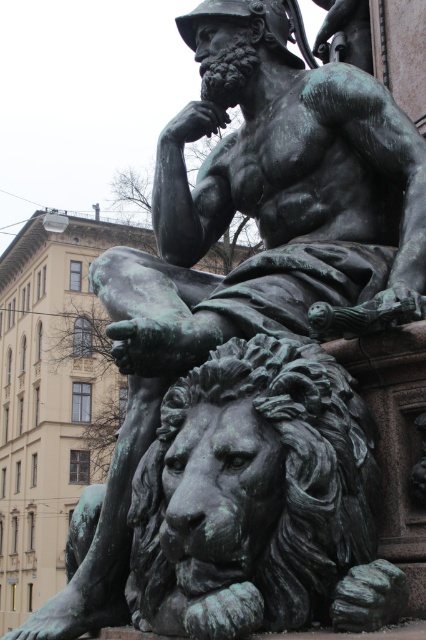
Consider the image. You are standing in front of an art gallery and see the green patina statue at center. If you want to take a photo of it, where should you position yourself to capture it in the frame?

You should position yourself directly in front of the green patina statue at center, which is located at coordinates point [270,202], to ensure it is centered in your photo.

You are an art conservator assessing the spatial arrangement of the bronze sculpture. Given that the green patina statue at center and the green patina lion at lower left are part of the same artwork, which object occupies a higher position in the composition?

The green patina statue at center is much taller than the green patina lion at lower left, so it occupies a higher position in the composition.

You are an art conservator examining the bronze sculptures in the garden. You notice both the green patina statue at center and the green patina lion at lower left. Which sculpture is located to the right of the other?

The green patina statue at center is positioned on the right side of green patina lion at lower left, so the statue at center is to the right of the lion at lower left.